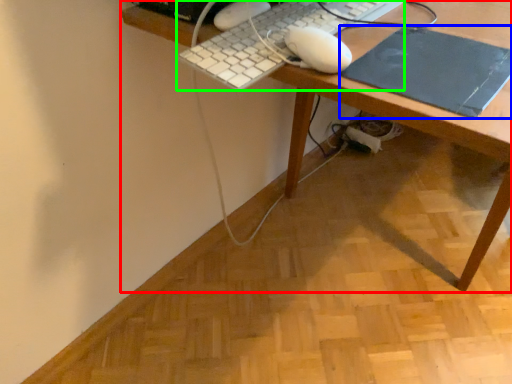
Question: Which object is positioned farthest from desk (highlighted by a red box)? Select from mousepad (highlighted by a blue box) and computer keyboard (highlighted by a green box).

Choices:
 (A) mousepad
 (B) computer keyboard

Answer: (B)